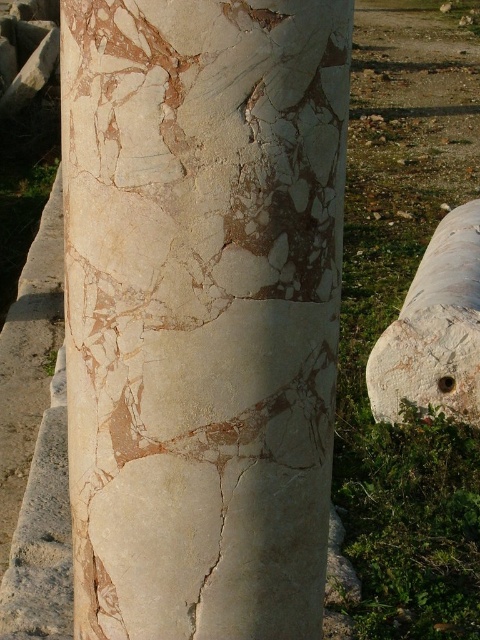
In the scene shown: Who is higher up, marble column at center or white marble column at center?

Positioned higher is white marble column at center.

In the scene shown: Who is lower down, marble column at center or white marble column at center?

Positioned lower is marble column at center.

Image resolution: width=480 pixels, height=640 pixels. What do you see at coordinates (202, 308) in the screenshot? I see `marble column at center` at bounding box center [202, 308].

Where is `marble column at center`? marble column at center is located at coordinates (202, 308).